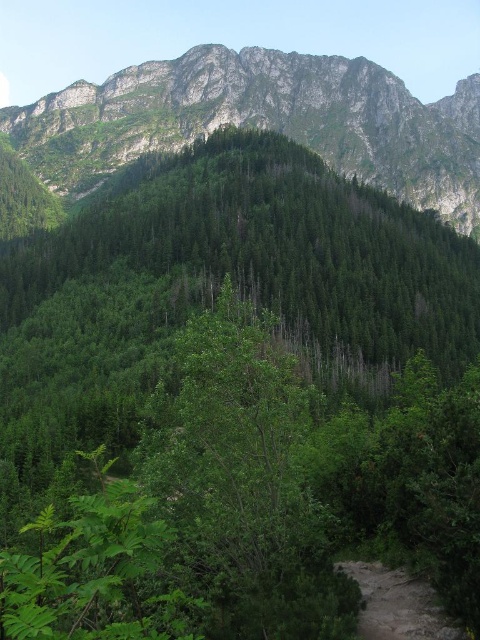
Which is below, green forested mountain at upper center or dirt path at lower right?

dirt path at lower right is lower down.

Who is more distant from viewer, [180,99] or [444,632]?

Positioned behind is point [180,99].

You are a GUI agent. You are given a task and a screenshot of the screen. Output one action in this format:
    pyautogui.click(x=<x>, y=<y>)
    Task: Click on the green forested mountain at upper center
    This screenshot has height=640, width=480.
    Given the screenshot: What is the action you would take?
    pyautogui.click(x=264, y=122)